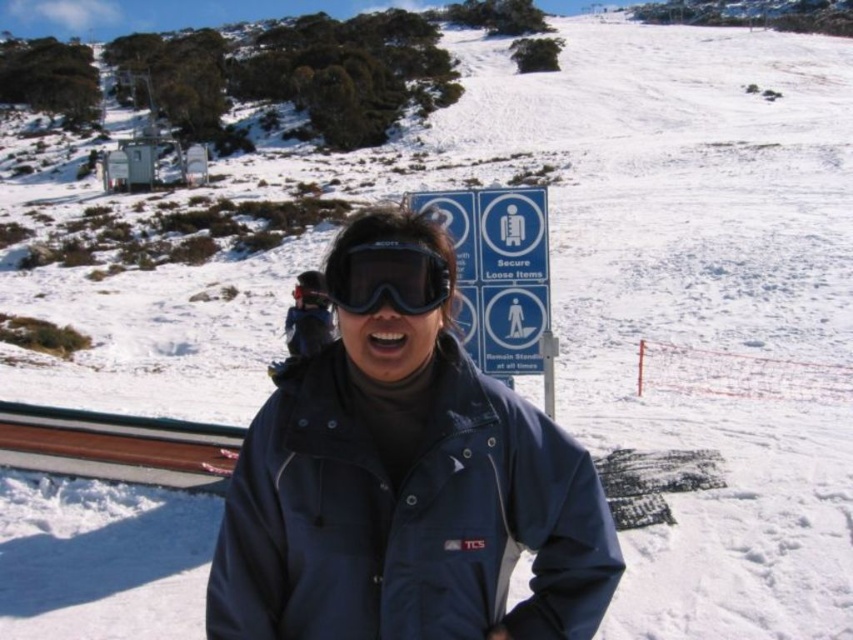
Question: In this image, where is navy blue jacket at center located relative to blue plastic sign at center?

Choices:
 (A) below
 (B) above

Answer: (A)

Question: Which point is farther from the camera taking this photo?

Choices:
 (A) 343,291
 (B) 512,316
 (C) 210,616

Answer: (B)

Question: Which object is farther from the camera taking this photo?

Choices:
 (A) navy blue jacket at center
 (B) black matte goggles at center

Answer: (A)

Question: Is navy blue jacket at center positioned in front of black matte goggles at center?

Choices:
 (A) no
 (B) yes

Answer: (A)

Question: Which of these objects is positioned closest to the blue plastic sign at center?

Choices:
 (A) navy blue jacket at center
 (B) black matte goggles at center

Answer: (A)

Question: Is navy blue jacket at center smaller than blue plastic sign at center?

Choices:
 (A) yes
 (B) no

Answer: (B)